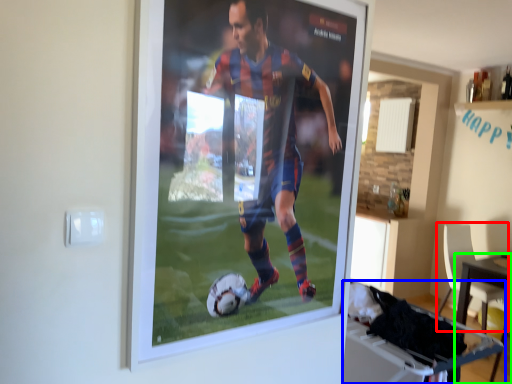
Question: Based on their relative distances, which object is farther from chair (highlighted by a red box)? Choose from table (highlighted by a blue box) and table (highlighted by a green box).

Choices:
 (A) table
 (B) table

Answer: (A)